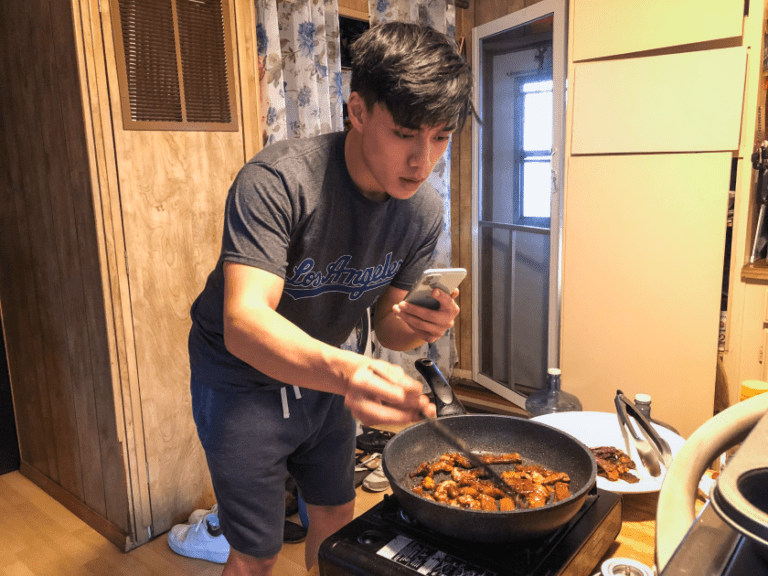
You are a GUI agent. You are given a task and a screenshot of the screen. Output one action in this format:
    pyautogui.click(x=<x>, y=<y>)
    Task: Click on the wooden floor
    This screenshot has width=768, height=576.
    Given the screenshot: What is the action you would take?
    click(x=55, y=522)